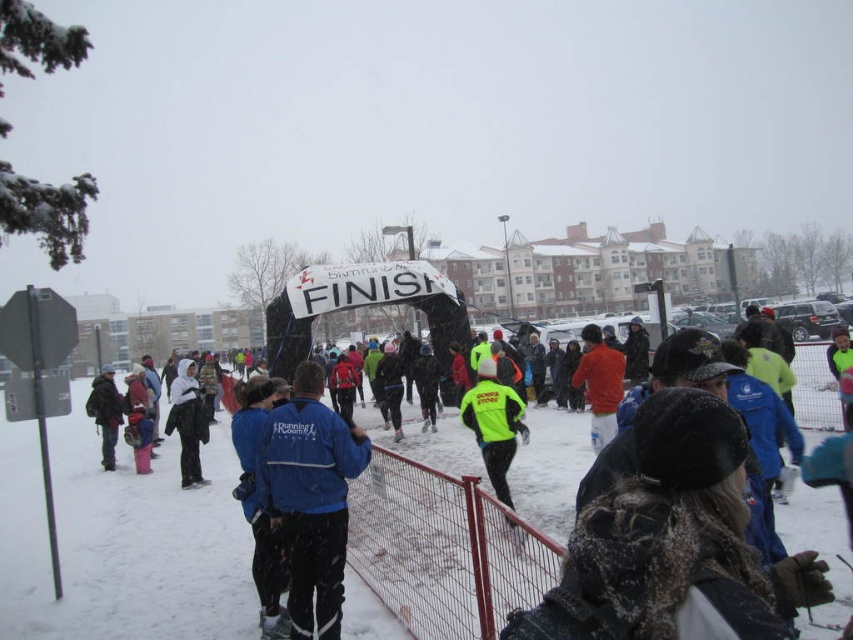
Question: Which point is closer to the camera?

Choices:
 (A) pyautogui.click(x=183, y=392)
 (B) pyautogui.click(x=534, y=492)
 (C) pyautogui.click(x=292, y=520)

Answer: (C)

Question: Estimate the real-world distances between objects in this image. Which object is farther from the blue fleece jacket at center?

Choices:
 (A) neon yellow jacket at center
 (B) dark blue jacket at center
 (C) reflective blue jacket at center
 (D) metal mesh fence at center

Answer: (B)

Question: Among these objects, which one is farthest from the camera?

Choices:
 (A) dark blue jacket at center
 (B) white fleece jacket at center
 (C) blue fleece jacket at center

Answer: (A)

Question: Does neon yellow jacket at center appear on the right side of dark blue jacket at center?

Choices:
 (A) yes
 (B) no

Answer: (A)

Question: Where is reflective blue jacket at center located in relation to neon yellow jacket at center in the image?

Choices:
 (A) below
 (B) above

Answer: (A)

Question: Where is neon yellow jacket at center located in relation to white fleece jacket at center in the image?

Choices:
 (A) above
 (B) below

Answer: (A)